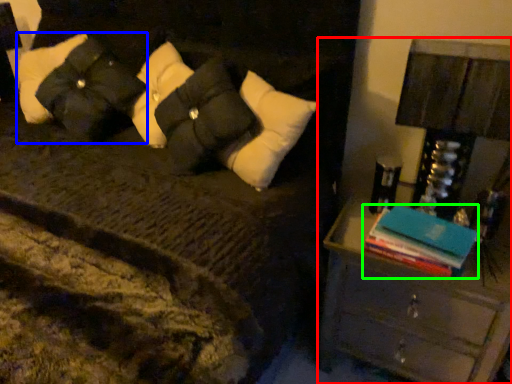
Question: Which object is the farthest from nightstand (highlighted by a red box)? Choose among these: pillow (highlighted by a blue box) or book (highlighted by a green box).

Choices:
 (A) pillow
 (B) book

Answer: (A)